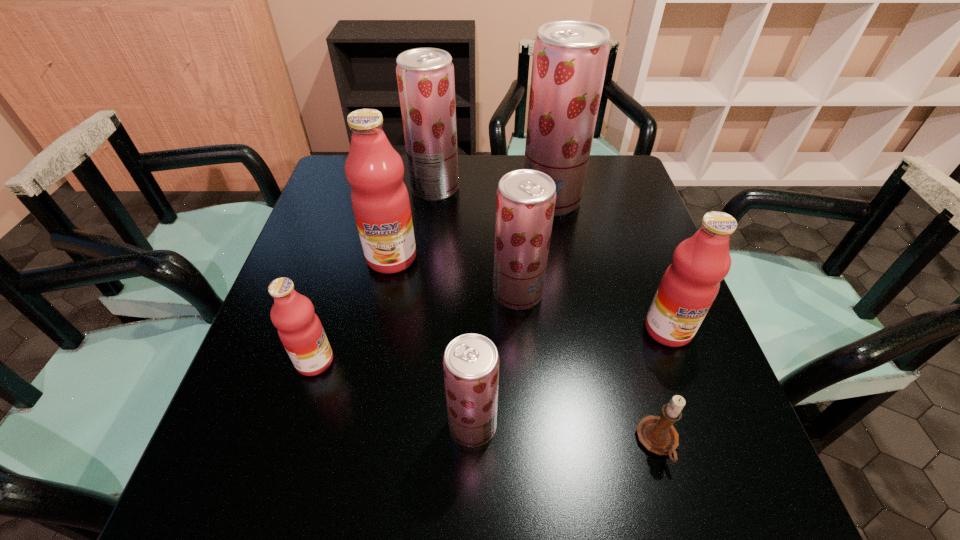
Where is `the fifth object from right to left`? The width and height of the screenshot is (960, 540). the fifth object from right to left is located at coordinates (471, 362).

Identify the location of the fourth fruit juice from left to right. The height and width of the screenshot is (540, 960). (471, 362).

The height and width of the screenshot is (540, 960). Identify the location of candle holder. (657, 434).

Identify the location of vacant space situated on the left of the tallest fruit juice. Image resolution: width=960 pixels, height=540 pixels. (490, 200).

Identify the location of vacant space situated on the front of the leftmost strawberry fruit juice. (420, 310).

Where is `vacant space situated 0.340m on the label of the farthest pink fruit juice`? vacant space situated 0.340m on the label of the farthest pink fruit juice is located at coordinates (362, 406).

Image resolution: width=960 pixels, height=540 pixels. I want to click on vacant space located on the left of the second smallest strawberry fruit juice, so click(x=398, y=293).

Find the location of a particular element. Image resolution: width=960 pixels, height=540 pixels. vacant area located on the label of the second smallest pink fruit juice is located at coordinates (710, 444).

Identify the location of free location located on the label of the smallest pink fruit juice. (383, 361).

You are a GUI agent. You are given a task and a screenshot of the screen. Output one action in this format:
    pyautogui.click(x=<x>, y=<y>)
    Task: Click on the vacant space located on the left of the smallest strawberry fruit juice
    The image size is (960, 540).
    Given the screenshot: What is the action you would take?
    pyautogui.click(x=261, y=426)